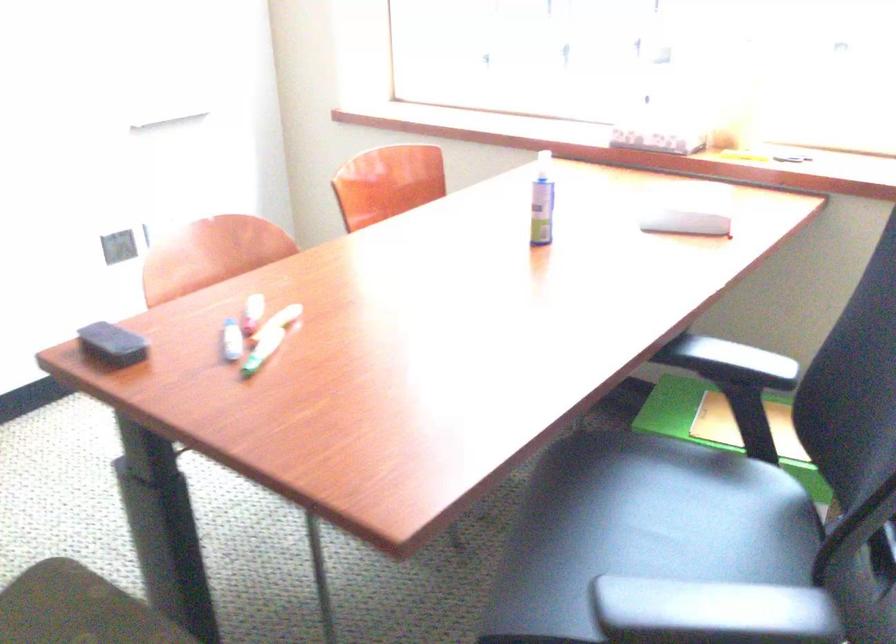
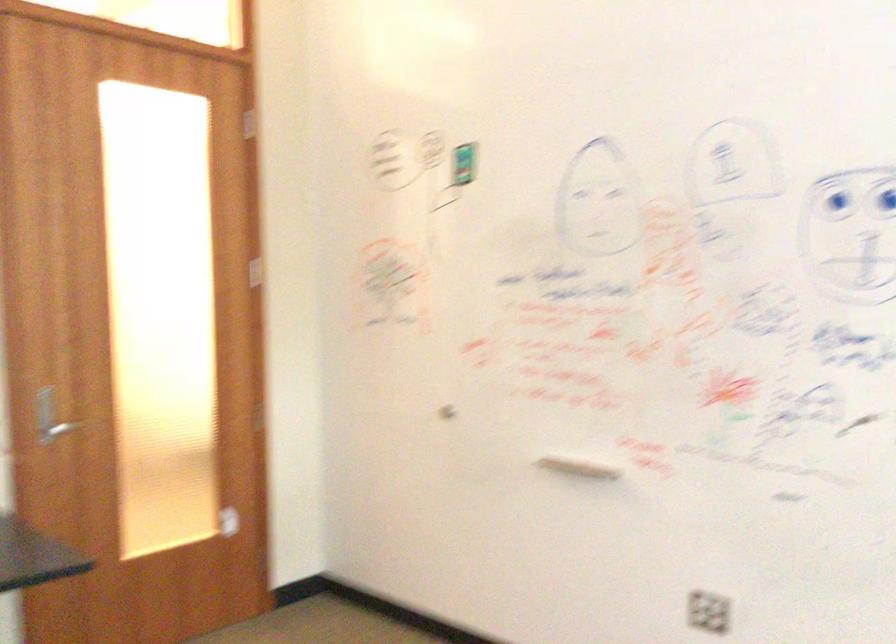
Question: How did the camera likely rotate?

Choices:
 (A) Left
 (B) Right
 (C) Up
 (D) Down

Answer: (A)